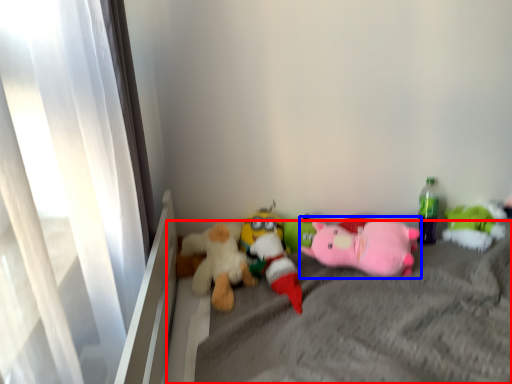
Question: Which of the following is the closest to the observer, mattress (highlighted by a red box) or toy (highlighted by a blue box)?

Choices:
 (A) mattress
 (B) toy

Answer: (A)